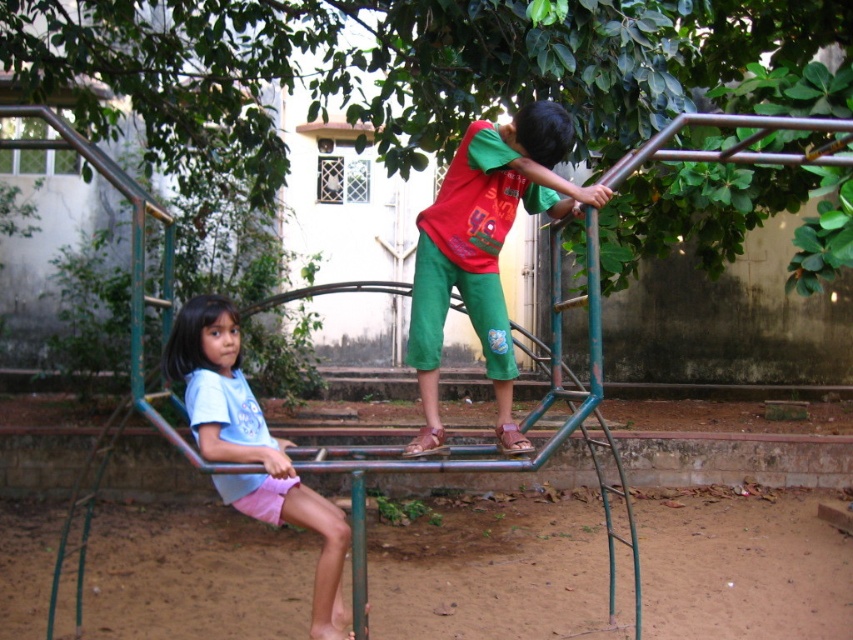
You are a parent trying to locate your child who is wearing a light blue fabric shirt at left and green cotton pants at center. Which piece of clothing will appear closer to you when looking at the image?

The green cotton pants at center will appear closer to you because it is further to the viewer than the light blue fabric shirt at left, meaning it occupies a more foreground position in the image.

You are designing a new playground uniform and need to know the size of the green cotton pants at center and light blue fabric shirt at left. Which one takes up more space in the image?

The light blue fabric shirt at left occupies more space than the green cotton pants at center.